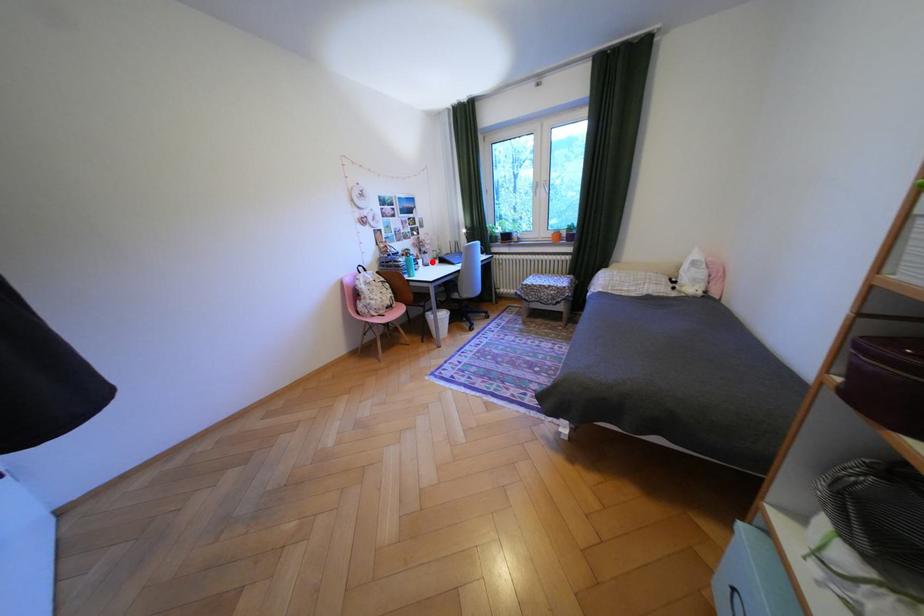
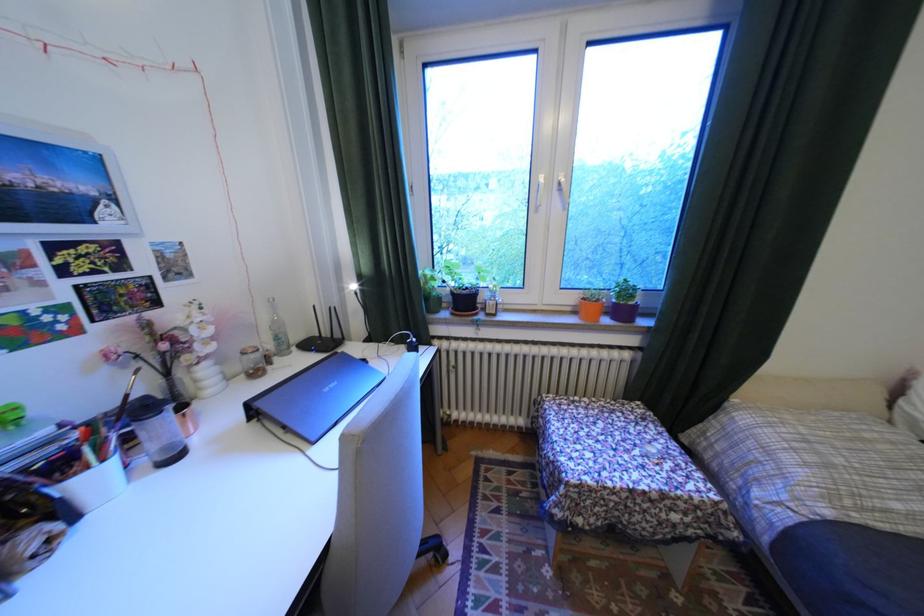
The point at the highlighted location is marked in the first image. Where is the corresponding point in the second image?

(106, 479)